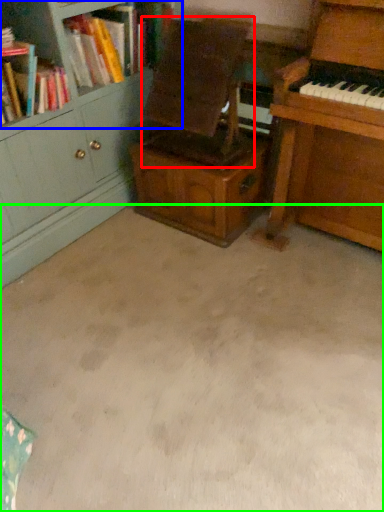
Question: Which is nearer to the armchair (highlighted by a red box)? bookcase (highlighted by a blue box) or plain (highlighted by a green box).

Choices:
 (A) bookcase
 (B) plain

Answer: (A)